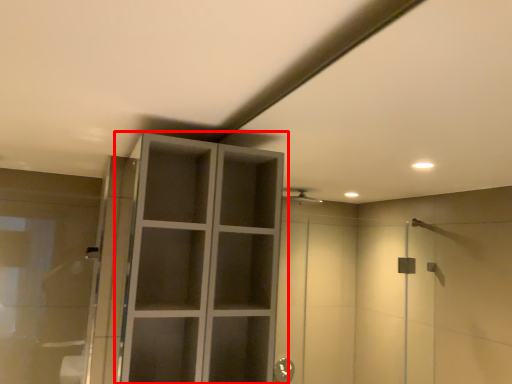
Question: From the image's perspective, what is the correct spatial relationship of cupboard (annotated by the red box) in relation to cabinetry?

Choices:
 (A) above
 (B) below

Answer: (A)